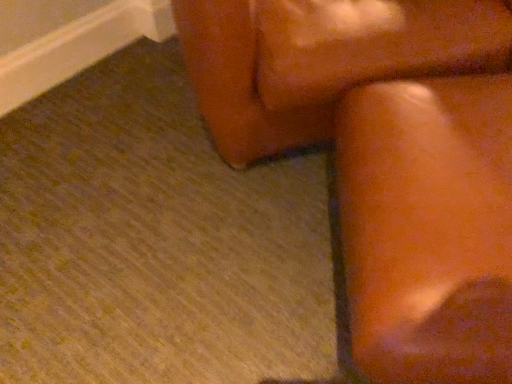
Question: Is brown leather rocking chair at upper right aimed at leather couch at upper right, the second furniture positioned from the bottom?

Choices:
 (A) yes
 (B) no

Answer: (B)

Question: From a real-world perspective, is brown leather rocking chair at upper right beneath leather couch at upper right, the second furniture positioned from the bottom?

Choices:
 (A) yes
 (B) no

Answer: (A)

Question: Does brown leather rocking chair at upper right come behind leather couch at upper right, which is counted as the first furniture, starting from the top?

Choices:
 (A) yes
 (B) no

Answer: (B)

Question: Considering the relative positions of brown leather rocking chair at upper right and leather couch at upper right, the second furniture positioned from the bottom, in the image provided, is brown leather rocking chair at upper right to the left of leather couch at upper right, the second furniture positioned from the bottom, from the viewer's perspective?

Choices:
 (A) yes
 (B) no

Answer: (A)

Question: From the image's perspective, is brown leather rocking chair at upper right located beneath leather couch at upper right, which is counted as the first furniture, starting from the top?

Choices:
 (A) yes
 (B) no

Answer: (A)

Question: Considering the relative positions of brown leather rocking chair at upper right and leather couch at upper right, which is counted as the first furniture, starting from the top, in the image provided, is brown leather rocking chair at upper right to the right of leather couch at upper right, which is counted as the first furniture, starting from the top, from the viewer's perspective?

Choices:
 (A) no
 (B) yes

Answer: (A)

Question: Is matte brown couch at right, positioned as the second furniture in top-to-bottom order, closer to the viewer compared to brown leather rocking chair at upper right?

Choices:
 (A) no
 (B) yes

Answer: (B)

Question: Would you say matte brown couch at right, which is counted as the first furniture, starting from the bottom, contains brown leather rocking chair at upper right?

Choices:
 (A) yes
 (B) no

Answer: (B)

Question: Considering the relative sizes of matte brown couch at right, positioned as the second furniture in top-to-bottom order, and brown leather rocking chair at upper right in the image provided, is matte brown couch at right, positioned as the second furniture in top-to-bottom order, taller than brown leather rocking chair at upper right?

Choices:
 (A) yes
 (B) no

Answer: (A)

Question: Is matte brown couch at right, which is counted as the first furniture, starting from the bottom, to the left of brown leather rocking chair at upper right from the viewer's perspective?

Choices:
 (A) no
 (B) yes

Answer: (A)

Question: From the image's perspective, is matte brown couch at right, positioned as the second furniture in top-to-bottom order, over brown leather rocking chair at upper right?

Choices:
 (A) yes
 (B) no

Answer: (B)

Question: From the image's perspective, would you say matte brown couch at right, positioned as the second furniture in top-to-bottom order, is shown under brown leather rocking chair at upper right?

Choices:
 (A) no
 (B) yes

Answer: (B)

Question: Considering the relative sizes of leather couch at upper right, which is counted as the first furniture, starting from the top, and brown leather rocking chair at upper right in the image provided, is leather couch at upper right, which is counted as the first furniture, starting from the top, bigger than brown leather rocking chair at upper right?

Choices:
 (A) no
 (B) yes

Answer: (B)